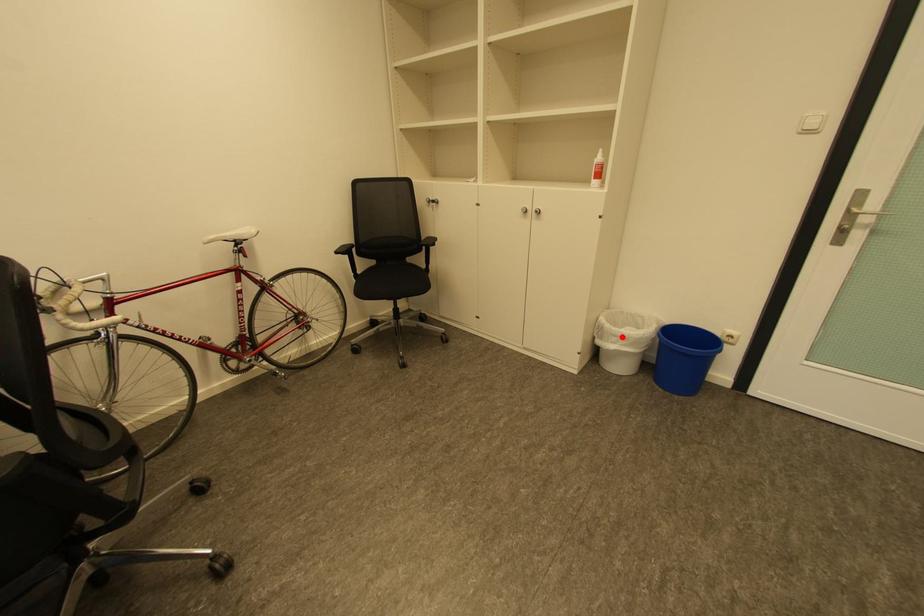
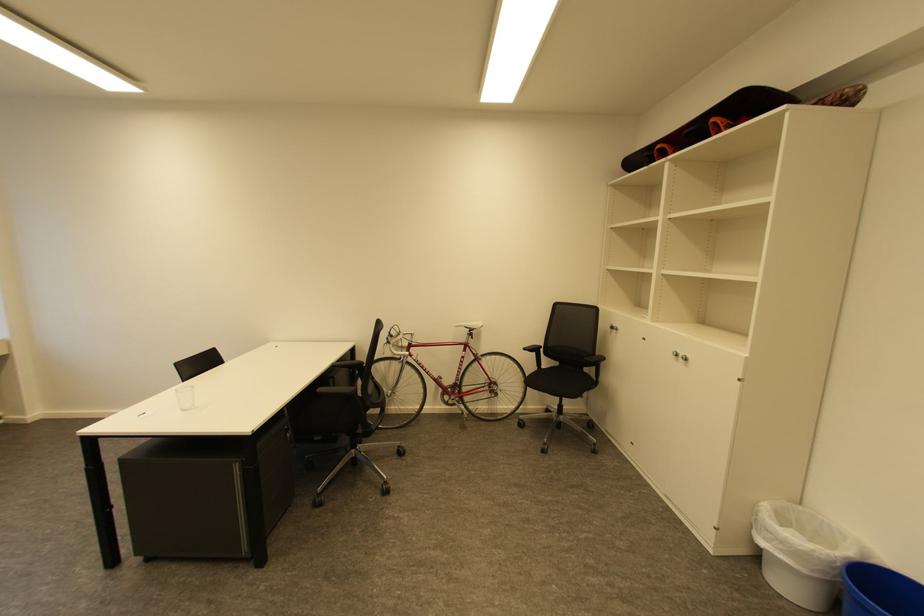
Question: I am providing you with two images of the same scene from different viewpoints. A red point is shown in image1. For the corresponding object point in image2, is it positioned nearer or farther from the camera?

Choices:
 (A) Nearer
 (B) Farther

Answer: (B)